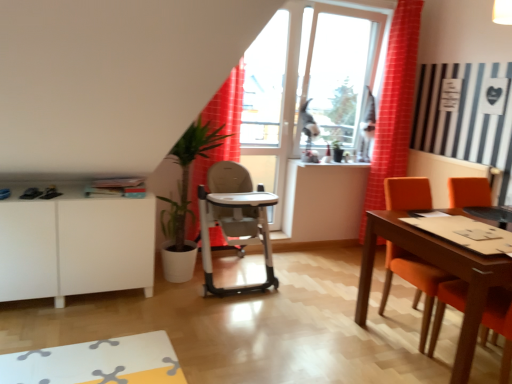
Question: Is matte orange chair at right turned away from red fabric curtain at center, which is counted as the 2th curtain, starting from the right?

Choices:
 (A) no
 (B) yes

Answer: (A)

Question: Does matte orange chair at right have a smaller size compared to red fabric curtain at center, which ranks as the 1th curtain in left-to-right order?

Choices:
 (A) yes
 (B) no

Answer: (B)

Question: From a real-world perspective, is matte orange chair at right located higher than red fabric curtain at center, which ranks as the 1th curtain in left-to-right order?

Choices:
 (A) no
 (B) yes

Answer: (A)

Question: Considering the relative positions of matte orange chair at right and red fabric curtain at center, which ranks as the 1th curtain in left-to-right order, in the image provided, is matte orange chair at right in front of red fabric curtain at center, which ranks as the 1th curtain in left-to-right order,?

Choices:
 (A) no
 (B) yes

Answer: (B)

Question: From a real-world perspective, is matte orange chair at right below red fabric curtain at center, which ranks as the 1th curtain in left-to-right order?

Choices:
 (A) yes
 (B) no

Answer: (A)

Question: Is matte orange chair at right located outside red fabric curtain at center, which is counted as the 2th curtain, starting from the right?

Choices:
 (A) no
 (B) yes

Answer: (B)

Question: From the image's perspective, is red fabric curtain at center, which ranks as the 1th curtain in left-to-right order, over matte orange chair at right?

Choices:
 (A) no
 (B) yes

Answer: (B)

Question: Is matte orange chair at right at the back of red fabric curtain at center, which is counted as the 2th curtain, starting from the right?

Choices:
 (A) yes
 (B) no

Answer: (B)

Question: From the image's perspective, is red fabric curtain at center, which is counted as the 2th curtain, starting from the right, under matte orange chair at right?

Choices:
 (A) no
 (B) yes

Answer: (A)

Question: Is red fabric curtain at center, which ranks as the 1th curtain in left-to-right order, placed right next to matte orange chair at right?

Choices:
 (A) no
 (B) yes

Answer: (A)

Question: Is red fabric curtain at center, which is counted as the 2th curtain, starting from the right, surrounding matte orange chair at right?

Choices:
 (A) no
 (B) yes

Answer: (A)

Question: Can you confirm if red fabric curtain at center, which is counted as the 2th curtain, starting from the right, is bigger than matte orange chair at right?

Choices:
 (A) yes
 (B) no

Answer: (B)

Question: Could you tell me if matte orange chair at right is facing white matte cabinet at lower left?

Choices:
 (A) yes
 (B) no

Answer: (B)